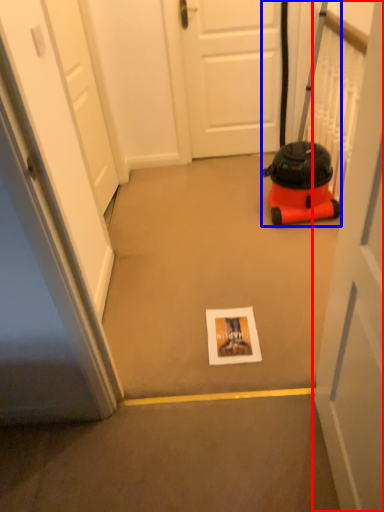
Question: Which object is closer to the camera taking this photo, door (highlighted by a red box) or equipment (highlighted by a blue box)?

Choices:
 (A) door
 (B) equipment

Answer: (A)